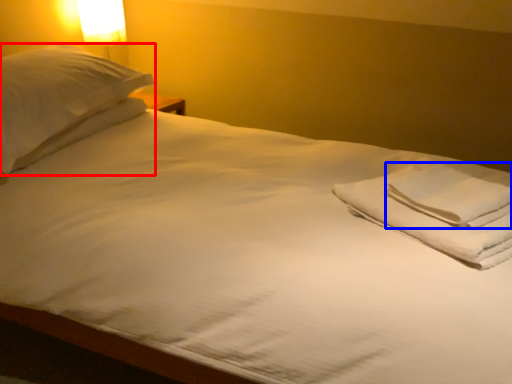
Question: Which point is further to the camera, pillow (highlighted by a red box) or hand towel (highlighted by a blue box)?

Choices:
 (A) pillow
 (B) hand towel

Answer: (A)